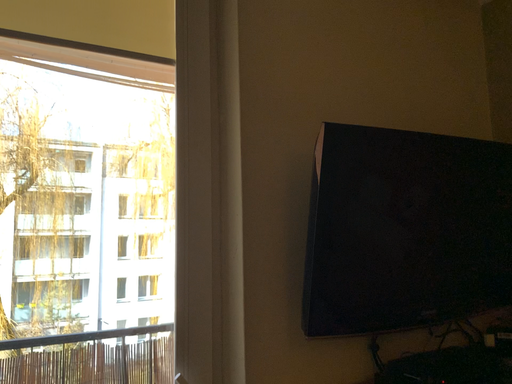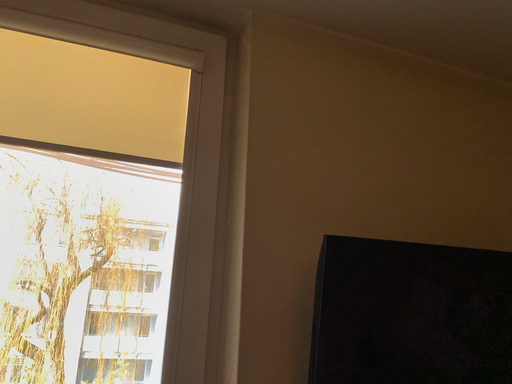
Question: Which way did the camera rotate in the video?

Choices:
 (A) rotated right
 (B) rotated left

Answer: (B)